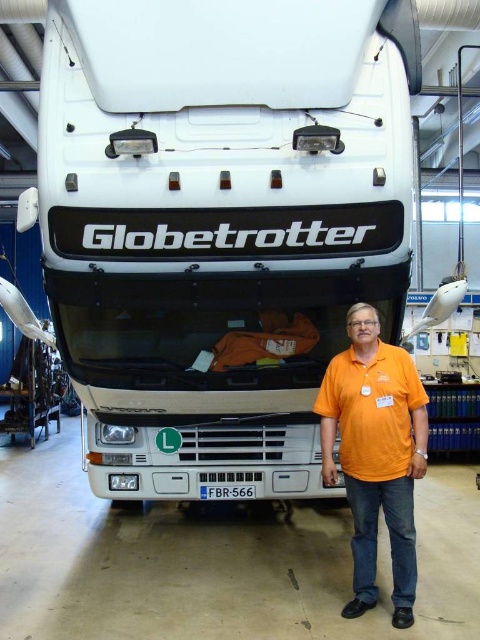
Can you confirm if white matte truck at center is bigger than orange cotton shirt at center?

Correct, white matte truck at center is larger in size than orange cotton shirt at center.

Is the position of white matte truck at center more distant than that of orange cotton shirt at center?

No.

Is point (299, 177) in front of point (360, 456)?

Yes, it is.

Identify the location of white matte truck at center. (218, 227).